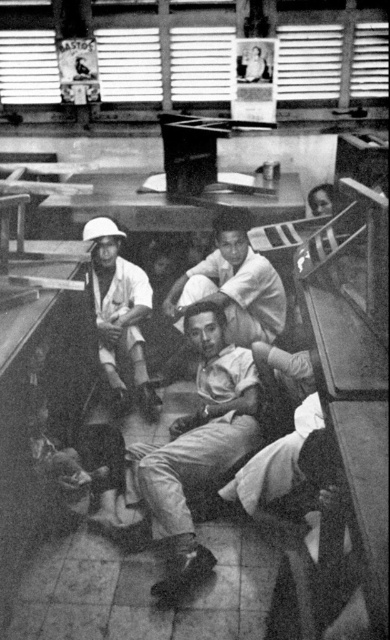
Question: Can you confirm if matte white shirt at center is positioned to the left of matte white helmet at upper left?

Choices:
 (A) yes
 (B) no

Answer: (B)

Question: Which point is farther to the camera?

Choices:
 (A) (230, 358)
 (B) (108, 368)
 (C) (262, 285)

Answer: (B)

Question: Which point is farther to the camera?

Choices:
 (A) matte white helmet at upper left
 (B) smooth skin man at center

Answer: (A)

Question: Which object is the farthest from the smooth skin man at center?

Choices:
 (A) matte white shirt at center
 (B) matte white helmet at upper left

Answer: (A)

Question: Is smooth skin man at center positioned in front of matte white helmet at upper left?

Choices:
 (A) no
 (B) yes

Answer: (B)

Question: Considering the relative positions of matte white shirt at center and matte white helmet at upper left in the image provided, where is matte white shirt at center located with respect to matte white helmet at upper left?

Choices:
 (A) below
 (B) above

Answer: (A)